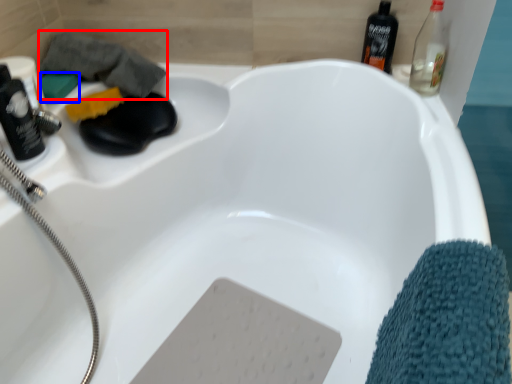
Question: Which point is further to the camera, bath towel (highlighted by a red box) or soap (highlighted by a blue box)?

Choices:
 (A) bath towel
 (B) soap

Answer: (B)